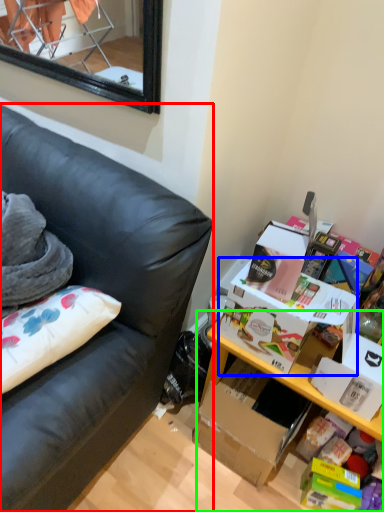
Question: Based on their relative distances, which object is nearer to studio couch (highlighted by a red box)? Choose from storage box (highlighted by a blue box) and table (highlighted by a green box).

Choices:
 (A) storage box
 (B) table

Answer: (A)